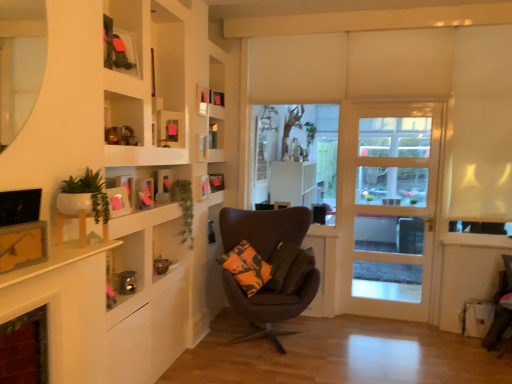
Question: From a real-world perspective, is pink paper picture frame at left, which ranks as the 10th picture frame in back-to-front order, on pink matte picture frame at upper center, acting as the 8th picture frame starting from the back?

Choices:
 (A) no
 (B) yes

Answer: (A)

Question: Is pink paper picture frame at left, which ranks as the 10th picture frame in back-to-front order, wider than pink matte picture frame at upper center, acting as the 8th picture frame starting from the back?

Choices:
 (A) no
 (B) yes

Answer: (B)

Question: Are pink paper picture frame at left, the 2th picture frame from the front, and pink matte picture frame at upper center, arranged as the 4th picture frame when viewed from the front, making contact?

Choices:
 (A) no
 (B) yes

Answer: (A)

Question: Considering the relative sizes of pink paper picture frame at left, the 2th picture frame from the front, and pink matte picture frame at upper center, arranged as the 4th picture frame when viewed from the front, in the image provided, is pink paper picture frame at left, the 2th picture frame from the front, thinner than pink matte picture frame at upper center, arranged as the 4th picture frame when viewed from the front,?

Choices:
 (A) yes
 (B) no

Answer: (B)

Question: From a real-world perspective, is pink paper picture frame at left, which ranks as the 10th picture frame in back-to-front order, under pink matte picture frame at upper center, acting as the 8th picture frame starting from the back?

Choices:
 (A) yes
 (B) no

Answer: (A)

Question: In terms of width, does wooden picture frame at upper center, the 4th picture frame viewed from the back, look wider or thinner when compared to white glass door at center?

Choices:
 (A) wide
 (B) thin

Answer: (B)

Question: From the image's perspective, is wooden picture frame at upper center, the 8th picture frame when ordered from front to back, located above or below white glass door at center?

Choices:
 (A) below
 (B) above

Answer: (B)

Question: In terms of size, does wooden picture frame at upper center, the 4th picture frame viewed from the back, appear bigger or smaller than white glass door at center?

Choices:
 (A) big
 (B) small

Answer: (B)

Question: From a real-world perspective, is wooden picture frame at upper center, the 8th picture frame when ordered from front to back, physically located above or below white glass door at center?

Choices:
 (A) above
 (B) below

Answer: (A)

Question: Considering the positions of wooden shelves at upper left and white matte planter at left, acting as the 2th plant starting from the back, in the image, is wooden shelves at upper left bigger or smaller than white matte planter at left, acting as the 2th plant starting from the back,?

Choices:
 (A) small
 (B) big

Answer: (B)

Question: From the image's perspective, relative to white matte planter at left, which appears as the 1th plant when viewed from the front, is wooden shelves at upper left above or below?

Choices:
 (A) below
 (B) above

Answer: (B)

Question: Is wooden shelves at upper left wider or thinner than white matte planter at left, acting as the 2th plant starting from the back?

Choices:
 (A) wide
 (B) thin

Answer: (A)

Question: Considering the positions of point (167, 51) and point (72, 198), is point (167, 51) closer or farther from the camera than point (72, 198)?

Choices:
 (A) closer
 (B) farther

Answer: (B)

Question: Considering the positions of pink matte picture frame at upper center, acting as the 8th picture frame starting from the back, and white glass door at center in the image, is pink matte picture frame at upper center, acting as the 8th picture frame starting from the back, taller or shorter than white glass door at center?

Choices:
 (A) tall
 (B) short

Answer: (B)

Question: From the image's perspective, is pink matte picture frame at upper center, arranged as the 4th picture frame when viewed from the front, positioned above or below white glass door at center?

Choices:
 (A) above
 (B) below

Answer: (A)